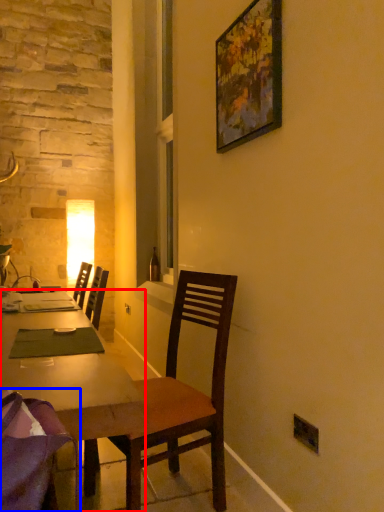
Question: Which object appears closest to the camera in this image, desk (highlighted by a red box) or chair (highlighted by a blue box)?

Choices:
 (A) desk
 (B) chair

Answer: (B)